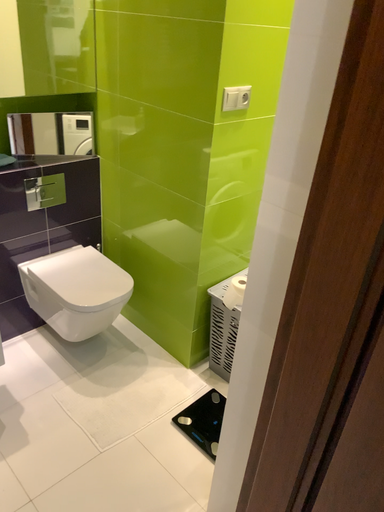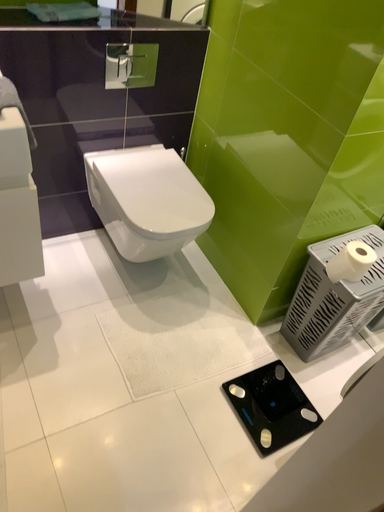
Question: Which way did the camera rotate in the video?

Choices:
 (A) rotated upward
 (B) rotated downward

Answer: (B)